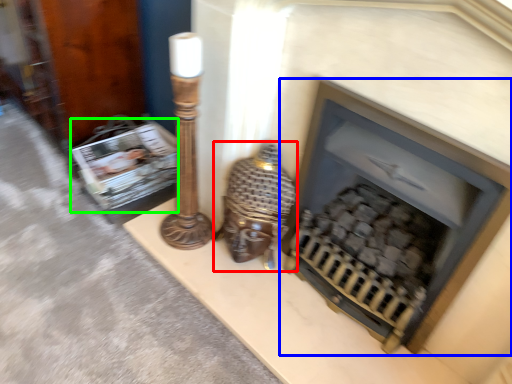
Question: Considering the real-world distances, which object is farthest from table lamp (highlighted by a red box)? fireplace (highlighted by a blue box) or magazine (highlighted by a green box)?

Choices:
 (A) fireplace
 (B) magazine

Answer: (B)